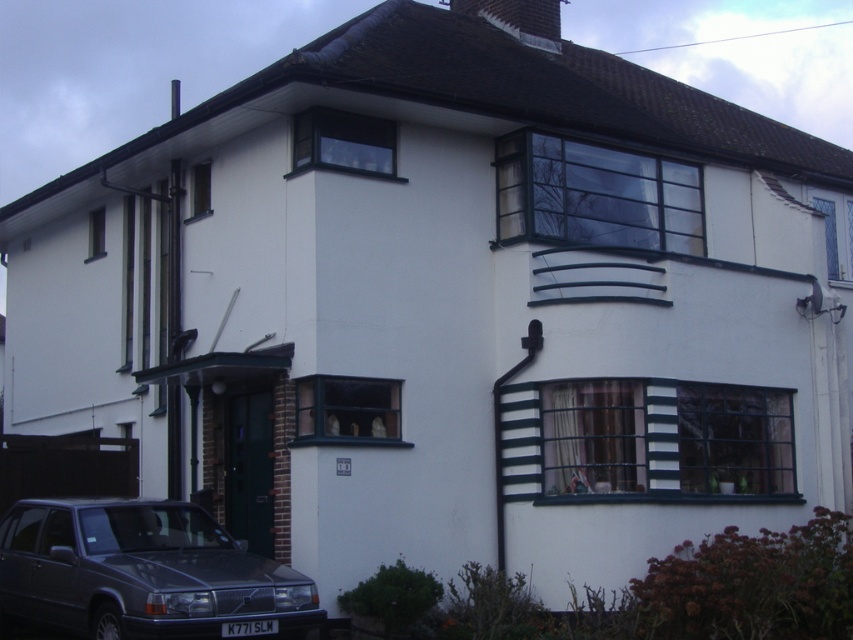
Between point (4, 544) and point (537, 35), which one is positioned in front?

Point (4, 544) is in front.

What are the coordinates of `dark gray metallic car at lower left` in the screenshot? It's located at (143, 572).